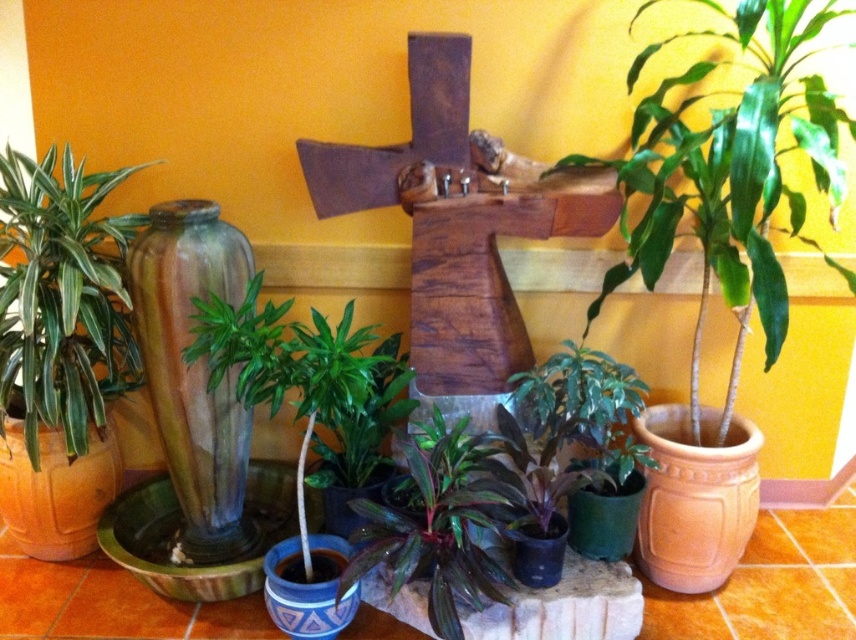
You are a gardener who needs to water the plants in the scene. You have a watering can in your left hand and a spray bottle in your right hand. The watering can is too heavy to move, so you decide to water the closest plant first. Which plant should you choose between the terracotta clay pot at right and the green matte vase at lower right?

The terracotta clay pot at right is closer to you than the green matte vase at lower right, so you should water the terracotta clay pot at right first.

You are planning to place a new small statue exactly between the green glossy plant at upper right and the green matte vase at lower right. Given their sizes, will the statue fit without overlapping either?

The green glossy plant at upper right is larger in size than the green matte vase at lower right. Since the statue is small, there should be enough space between them to place it without overlapping either object.